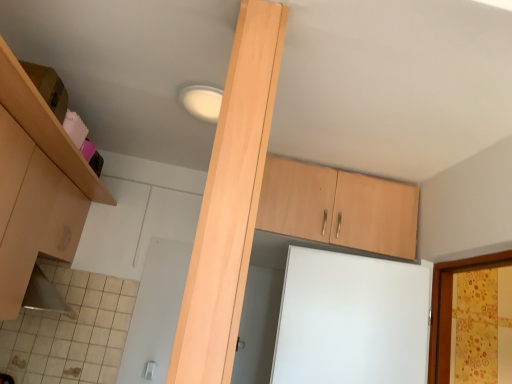
Image resolution: width=512 pixels, height=384 pixels. I want to click on light wood cabinet at upper center, the second cabinetry viewed from the left, so click(338, 208).

What do you see at coordinates (36, 184) in the screenshot? The height and width of the screenshot is (384, 512). I see `matte wood cabinet at upper left, which is counted as the first cabinetry, starting from the left` at bounding box center [36, 184].

Locate an element on the screen. light wood beam at center is located at coordinates (230, 201).

What are the coordinates of `light wood cabinet at upper center, acting as the first cabinetry starting from the right` in the screenshot? It's located at (338, 208).

How distant is light wood cabinet at upper center, the second cabinetry viewed from the left, from light wood beam at center?

1.22 meters.

In terms of width, does light wood cabinet at upper center, the second cabinetry viewed from the left, look wider or thinner when compared to light wood beam at center?

light wood cabinet at upper center, the second cabinetry viewed from the left, is wider than light wood beam at center.

At what (x,y) coordinates should I click in order to perform the action: click on beam above the light wood cabinet at upper center, the second cabinetry viewed from the left (from the image's perspective). Please return your answer as a coordinate pair (x, y). Looking at the image, I should click on (230, 201).

Does light wood cabinet at upper center, the second cabinetry viewed from the left, appear on the left side of light wood beam at center?

Incorrect, light wood cabinet at upper center, the second cabinetry viewed from the left, is not on the left side of light wood beam at center.

Is light wood cabinet at upper center, the second cabinetry viewed from the left, bigger or smaller than matte wood cabinet at upper left, which is counted as the first cabinetry, starting from the left?

Considering their sizes, light wood cabinet at upper center, the second cabinetry viewed from the left, takes up less space than matte wood cabinet at upper left, which is counted as the first cabinetry, starting from the left.

Is light wood cabinet at upper center, acting as the first cabinetry starting from the right, turned away from matte wood cabinet at upper left, positioned as the 2th cabinetry in right-to-left order?

light wood cabinet at upper center, acting as the first cabinetry starting from the right, does not have its back to matte wood cabinet at upper left, positioned as the 2th cabinetry in right-to-left order.

Which is closer to the camera, (411, 248) or (33, 176)?

Positioned in front is point (33, 176).

Who is more distant, light wood cabinet at upper center, the second cabinetry viewed from the left, or matte wood cabinet at upper left, which is counted as the first cabinetry, starting from the left?

light wood cabinet at upper center, the second cabinetry viewed from the left.

Where is `beam behind the matte wood cabinet at upper left, which is counted as the first cabinetry, starting from the left`? Image resolution: width=512 pixels, height=384 pixels. beam behind the matte wood cabinet at upper left, which is counted as the first cabinetry, starting from the left is located at coordinates (230, 201).

Is matte wood cabinet at upper left, which is counted as the first cabinetry, starting from the left, a part of light wood beam at center?

That's incorrect, matte wood cabinet at upper left, which is counted as the first cabinetry, starting from the left, is not inside light wood beam at center.

Considering the points (218, 214) and (35, 224), which point is in front, point (218, 214) or point (35, 224)?

Point (218, 214)

Can you tell me how much light wood beam at center and light wood cabinet at upper center, acting as the first cabinetry starting from the right, differ in facing direction?

The facing directions of light wood beam at center and light wood cabinet at upper center, acting as the first cabinetry starting from the right, are 95.8 degrees apart.

You are a GUI agent. You are given a task and a screenshot of the screen. Output one action in this format:
    pyautogui.click(x=<x>, y=<y>)
    Task: Click on the cabinetry above the light wood beam at center (from a real-world perspective)
    
    Given the screenshot: What is the action you would take?
    pyautogui.click(x=338, y=208)

Between light wood beam at center and light wood cabinet at upper center, the second cabinetry viewed from the left, which one has larger size?

light wood cabinet at upper center, the second cabinetry viewed from the left, is bigger.

Does matte wood cabinet at upper left, which is counted as the first cabinetry, starting from the left, lie behind light wood beam at center?

No, matte wood cabinet at upper left, which is counted as the first cabinetry, starting from the left, is closer to the viewer.

From a real-world perspective, does matte wood cabinet at upper left, positioned as the 2th cabinetry in right-to-left order, stand above light wood beam at center?

No, from a real-world perspective, matte wood cabinet at upper left, positioned as the 2th cabinetry in right-to-left order, is not above light wood beam at center.

Is point (1, 227) closer or farther from the camera than point (219, 280)?

Point (1, 227) is farther from the camera than point (219, 280).

Is matte wood cabinet at upper left, which is counted as the first cabinetry, starting from the left, taller or shorter than light wood beam at center?

Clearly, matte wood cabinet at upper left, which is counted as the first cabinetry, starting from the left, is shorter compared to light wood beam at center.

Is matte wood cabinet at upper left, positioned as the 2th cabinetry in right-to-left order, aimed at light wood cabinet at upper center, the second cabinetry viewed from the left?

Yes, matte wood cabinet at upper left, positioned as the 2th cabinetry in right-to-left order, is aimed at light wood cabinet at upper center, the second cabinetry viewed from the left.

Considering the positions of objects matte wood cabinet at upper left, positioned as the 2th cabinetry in right-to-left order, and light wood cabinet at upper center, acting as the first cabinetry starting from the right, in the image provided, who is more to the left, matte wood cabinet at upper left, positioned as the 2th cabinetry in right-to-left order, or light wood cabinet at upper center, acting as the first cabinetry starting from the right,?

matte wood cabinet at upper left, positioned as the 2th cabinetry in right-to-left order, is more to the left.

The width and height of the screenshot is (512, 384). In order to click on beam located in front of the light wood cabinet at upper center, the second cabinetry viewed from the left in this screenshot , I will do `click(230, 201)`.

Identify the location of cabinetry on the left of light wood cabinet at upper center, the second cabinetry viewed from the left. (36, 184).

Considering their positions, is light wood beam at center positioned closer to matte wood cabinet at upper left, which is counted as the first cabinetry, starting from the left, than light wood cabinet at upper center, acting as the first cabinetry starting from the right?

Based on the image, light wood beam at center appears to be nearer to matte wood cabinet at upper left, which is counted as the first cabinetry, starting from the left.

Based on their spatial positions, is matte wood cabinet at upper left, which is counted as the first cabinetry, starting from the left, or light wood cabinet at upper center, acting as the first cabinetry starting from the right, further from light wood beam at center?

Based on the image, light wood cabinet at upper center, acting as the first cabinetry starting from the right, appears to be further to light wood beam at center.

Looking at the image, which one is located further to light wood cabinet at upper center, acting as the first cabinetry starting from the right, matte wood cabinet at upper left, positioned as the 2th cabinetry in right-to-left order, or light wood beam at center?

Among the two, light wood beam at center is located further to light wood cabinet at upper center, acting as the first cabinetry starting from the right.

When comparing their distances from light wood cabinet at upper center, acting as the first cabinetry starting from the right, does light wood beam at center or matte wood cabinet at upper left, positioned as the 2th cabinetry in right-to-left order, seem further?

light wood beam at center lies further to light wood cabinet at upper center, acting as the first cabinetry starting from the right, than the other object.

Estimate the real-world distances between objects in this image. Which object is closer to matte wood cabinet at upper left, which is counted as the first cabinetry, starting from the left, light wood cabinet at upper center, the second cabinetry viewed from the left, or light wood beam at center?

light wood beam at center.

When comparing their distances from light wood beam at center, does light wood cabinet at upper center, acting as the first cabinetry starting from the right, or matte wood cabinet at upper left, which is counted as the first cabinetry, starting from the left, seem further?

Among the two, light wood cabinet at upper center, acting as the first cabinetry starting from the right, is located further to light wood beam at center.

Find the location of a particular element. This screenshot has height=384, width=512. beam positioned between matte wood cabinet at upper left, which is counted as the first cabinetry, starting from the left, and light wood cabinet at upper center, acting as the first cabinetry starting from the right, from near to far is located at coordinates (230, 201).